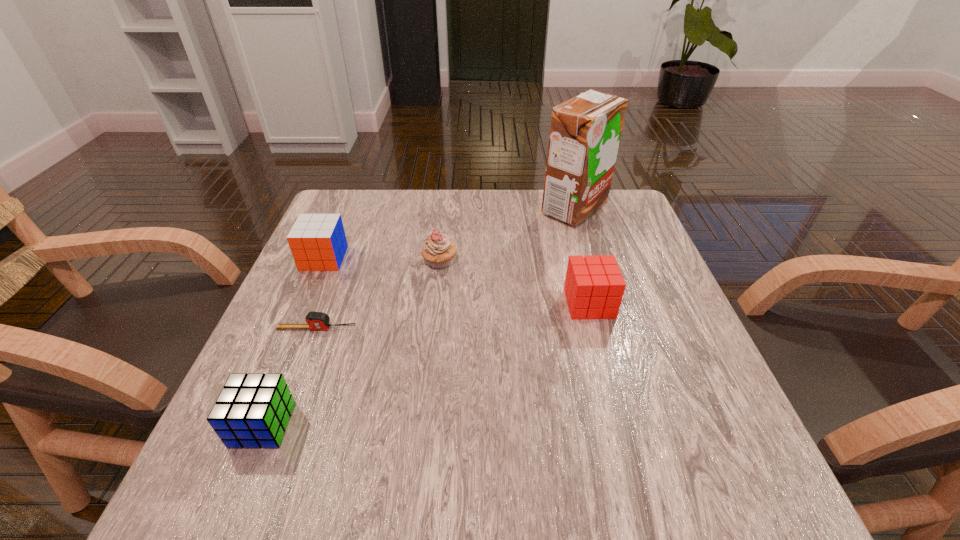
Locate an element on the screen. The width and height of the screenshot is (960, 540). carton is located at coordinates (585, 131).

The height and width of the screenshot is (540, 960). What are the coordinates of `the farthest object` in the screenshot? It's located at (585, 131).

You are a GUI agent. You are given a task and a screenshot of the screen. Output one action in this format:
    pyautogui.click(x=<x>, y=<y>)
    Task: Click on the cupcake
    The image size is (960, 540).
    Given the screenshot: What is the action you would take?
    pyautogui.click(x=438, y=251)

This screenshot has height=540, width=960. Identify the location of the farthest cube. pos(317,242).

Locate an element on the screen. the rightmost cube is located at coordinates (594, 286).

This screenshot has height=540, width=960. I want to click on the second nearest cube, so coord(594,286).

I want to click on the nearest object, so click(x=252, y=411).

Locate an element on the screen. The height and width of the screenshot is (540, 960). the second nearest object is located at coordinates (315, 320).

This screenshot has height=540, width=960. What are the coordinates of `the shortest object` in the screenshot? It's located at (315, 320).

The width and height of the screenshot is (960, 540). Find the location of `vacant area situated 0.310m on the straw side of the carton`. vacant area situated 0.310m on the straw side of the carton is located at coordinates 424,209.